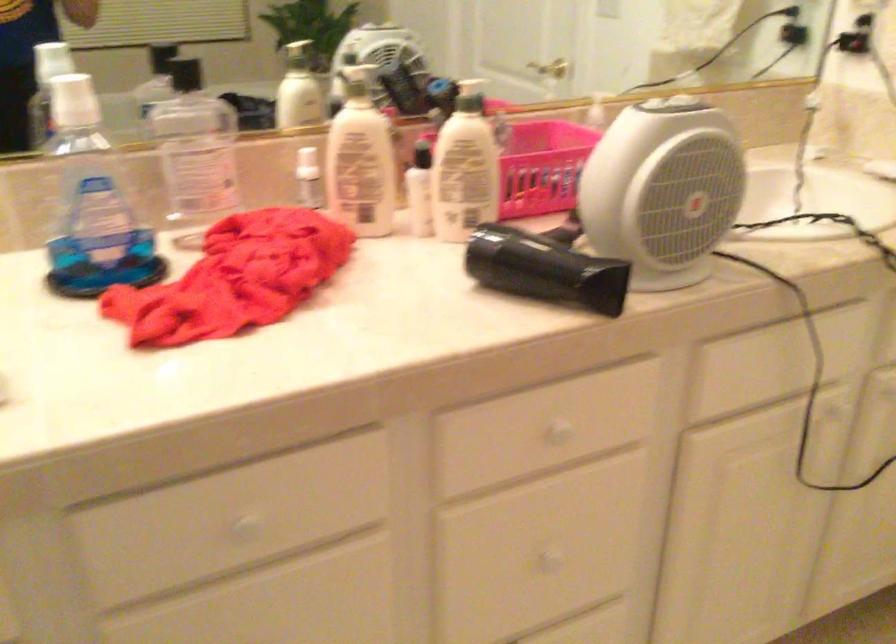
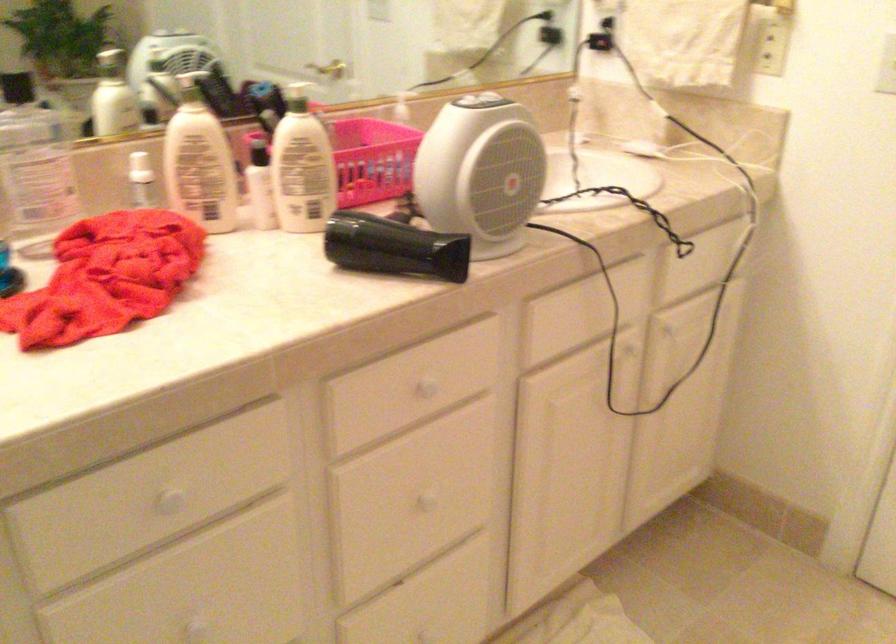
Locate, in the second image, the point that corresponds to point 565,431 in the first image.

(426, 386)